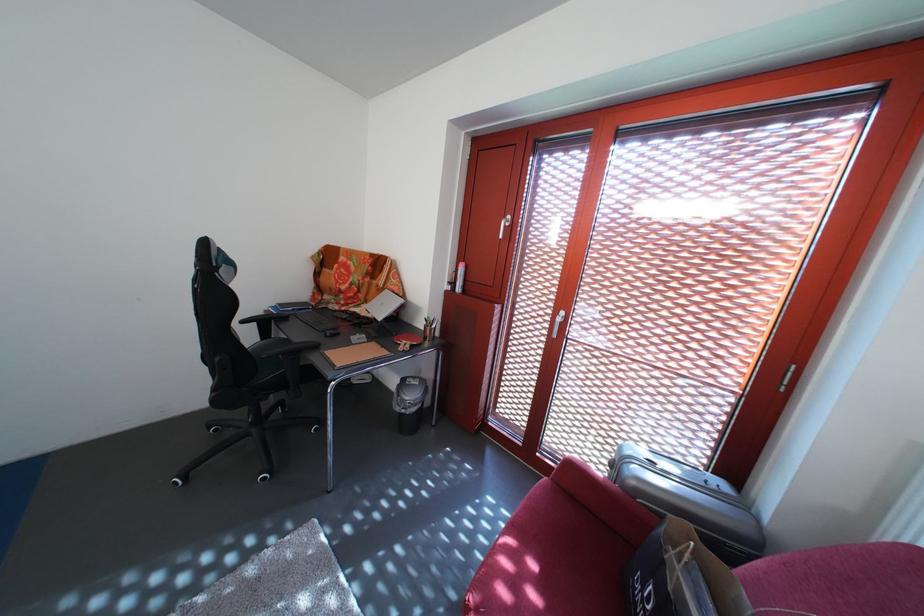
Where is `chair sitting surface`? Image resolution: width=924 pixels, height=616 pixels. chair sitting surface is located at coordinates (266, 347).